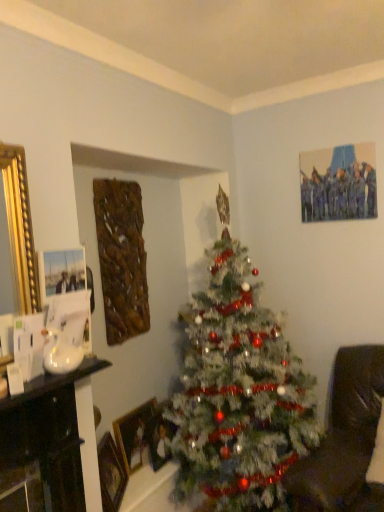
Question: Does wooden picture frame at lower left, marked as the 2th picture frame in a front-to-back arrangement, have a smaller size compared to white frosted christmas tree at center?

Choices:
 (A) yes
 (B) no

Answer: (A)

Question: Does wooden picture frame at lower left, marked as the 2th picture frame in a front-to-back arrangement, have a larger size compared to white frosted christmas tree at center?

Choices:
 (A) no
 (B) yes

Answer: (A)

Question: Would you consider wooden picture frame at lower left, the second picture frame viewed from the back, to be distant from white frosted christmas tree at center?

Choices:
 (A) yes
 (B) no

Answer: (B)

Question: From a real-world perspective, is wooden picture frame at lower left, marked as the 2th picture frame in a front-to-back arrangement, located higher than white frosted christmas tree at center?

Choices:
 (A) no
 (B) yes

Answer: (A)

Question: Does wooden picture frame at lower left, the second picture frame viewed from the back, have a lesser width compared to white frosted christmas tree at center?

Choices:
 (A) yes
 (B) no

Answer: (A)

Question: Does point (339, 370) appear closer or farther from the camera than point (23, 386)?

Choices:
 (A) farther
 (B) closer

Answer: (A)

Question: Is brown leather rocking chair at lower right in front of or behind white glossy sink at left in the image?

Choices:
 (A) front
 (B) behind

Answer: (A)

Question: Looking at the image, does brown leather rocking chair at lower right seem bigger or smaller compared to white glossy sink at left?

Choices:
 (A) big
 (B) small

Answer: (A)

Question: Is brown leather rocking chair at lower right wider or thinner than white glossy sink at left?

Choices:
 (A) wide
 (B) thin

Answer: (A)

Question: Is point (339, 438) positioned closer to the camera than point (157, 428)?

Choices:
 (A) closer
 (B) farther

Answer: (A)

Question: Considering the positions of brown leather rocking chair at lower right and wooden picture frame at center, the 3th picture frame positioned from the front, in the image, is brown leather rocking chair at lower right taller or shorter than wooden picture frame at center, the 3th picture frame positioned from the front,?

Choices:
 (A) tall
 (B) short

Answer: (A)

Question: Relative to wooden picture frame at center, the 3th picture frame positioned from the front, is brown leather rocking chair at lower right in front or behind?

Choices:
 (A) behind
 (B) front

Answer: (B)

Question: Would you say brown leather rocking chair at lower right is to the left or to the right of wooden picture frame at center, which appears as the first picture frame when viewed from the back, in the picture?

Choices:
 (A) right
 (B) left

Answer: (A)

Question: From a real-world perspective, is brown leather rocking chair at lower right positioned above or below white frosted christmas tree at center?

Choices:
 (A) below
 (B) above

Answer: (A)

Question: Looking at their shapes, would you say brown leather rocking chair at lower right is wider or thinner than white frosted christmas tree at center?

Choices:
 (A) thin
 (B) wide

Answer: (B)